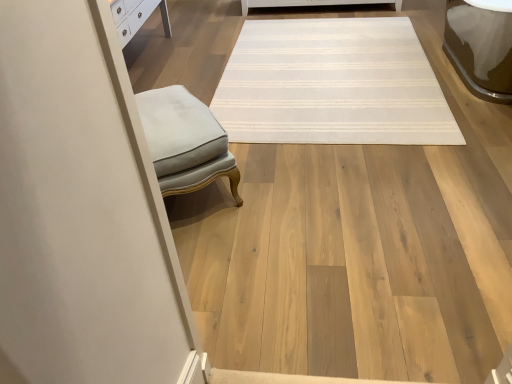
Identify the location of vacant area located to the right-hand side of light gray fabric ottoman at left. (281, 173).